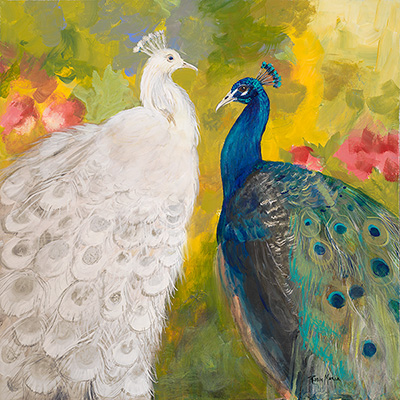
You are a GUI agent. You are given a task and a screenshot of the screen. Output one action in this format:
    pyautogui.click(x=<x>, y=<y>)
    Task: Click on the green paint
    This screenshot has width=400, height=400.
    Given the screenshot: What is the action you would take?
    pyautogui.click(x=187, y=364), pyautogui.click(x=239, y=379), pyautogui.click(x=209, y=303), pyautogui.click(x=238, y=35), pyautogui.click(x=55, y=54), pyautogui.click(x=386, y=102), pyautogui.click(x=380, y=189)